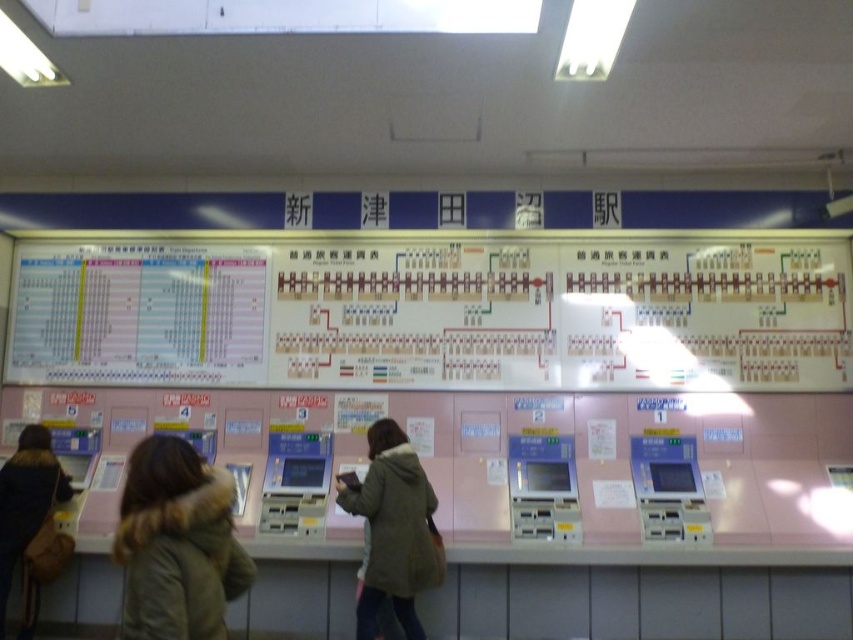
You are a traveler carrying a 4 feet wide box and need to pass between the green fuzzy coat at center and the light brown fur coat at lower left. Can you fit through the space between them?

The green fuzzy coat at center is 7.14 feet from the light brown fur coat at lower left, so yes, the traveler can fit through the space between them since the distance is wider than the box.